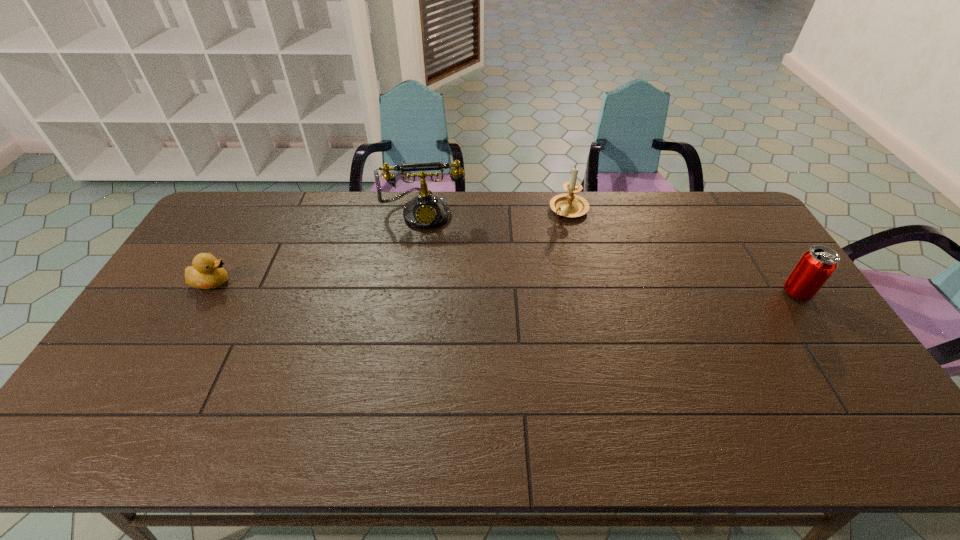
Identify the location of free space on the desktop that is between the leftmost object and the rightmost object and is positioned with a handle on the side of the second object from right to left. (492, 287).

At what (x,y) coordinates should I click in order to perform the action: click on vacant spot on the desktop that is between the shortest object and the rightmost object and is positioned on the dial of the telephone. Please return your answer as a coordinate pair (x, y). Image resolution: width=960 pixels, height=540 pixels. Looking at the image, I should click on (423, 286).